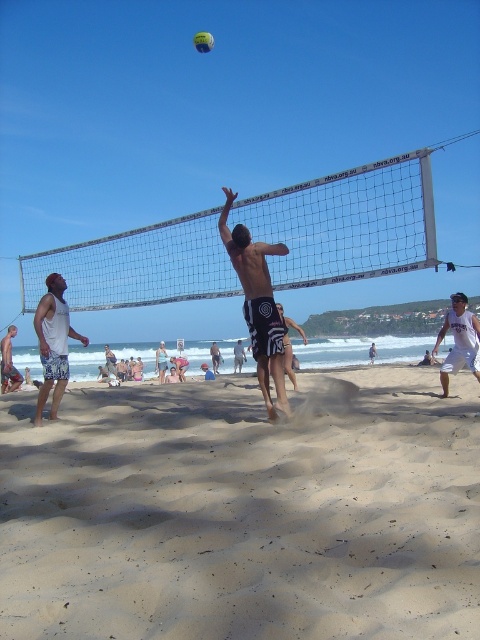
Question: Considering the relative positions of black mesh shorts at center and light blue denim shorts at center in the image provided, where is black mesh shorts at center located with respect to light blue denim shorts at center?

Choices:
 (A) above
 (B) below

Answer: (A)

Question: Is the position of white textured shorts at left less distant than that of light blue denim shorts at center?

Choices:
 (A) yes
 (B) no

Answer: (A)

Question: Which point is closer to the camera?

Choices:
 (A) [12, 336]
 (B) [204, 49]
 (C) [164, 364]
 (D) [287, 369]

Answer: (D)

Question: Does fine-grained sand at lower center have a smaller size compared to tan skin man at center?

Choices:
 (A) no
 (B) yes

Answer: (B)

Question: Considering the real-world distances, which object is closest to the white textured shorts at left?

Choices:
 (A) shiny black shorts at center
 (B) tan skin man at center
 (C) light blue denim shorts at center

Answer: (C)

Question: Which of the following is the farthest from the observer?

Choices:
 (A) tan skin man at center
 (B) white textured shorts at left
 (C) white tank top at left
 (D) light blue denim shorts at center

Answer: (A)